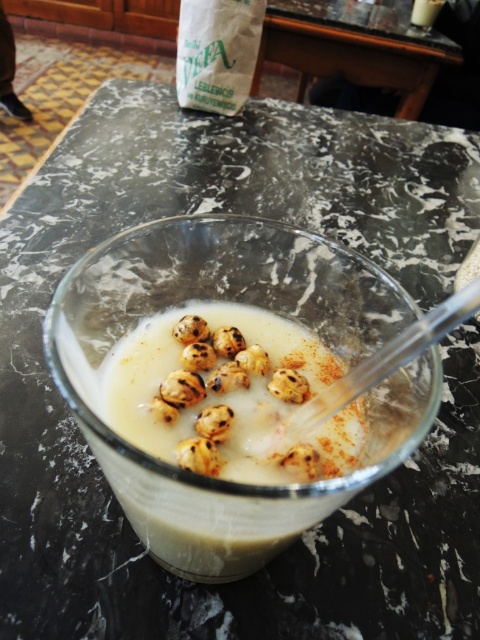
Who is lower down, marble table at center or brown charred balls at center?

Positioned lower is brown charred balls at center.

Can you confirm if marble table at center is wider than brown charred balls at center?

Yes, marble table at center is wider than brown charred balls at center.

Image resolution: width=480 pixels, height=640 pixels. Describe the element at coordinates (355, 48) in the screenshot. I see `marble table at center` at that location.

Image resolution: width=480 pixels, height=640 pixels. Identify the location of marble table at center. (355, 48).

Is point (263, 369) more distant than point (298, 394)?

Yes, it is.

Find the location of a particular element. brown charred balls at center is located at coordinates (218, 369).

Based on the photo, between marble table at center and brown textured nut at center, which one appears on the right side from the viewer's perspective?

marble table at center is more to the right.

How much distance is there between marble table at center and brown textured nut at center?

They are 5.66 feet apart.

Between point (424, 74) and point (304, 392), which one is positioned in front?

Point (304, 392) is in front.

Identify the location of marble table at center. (355, 48).